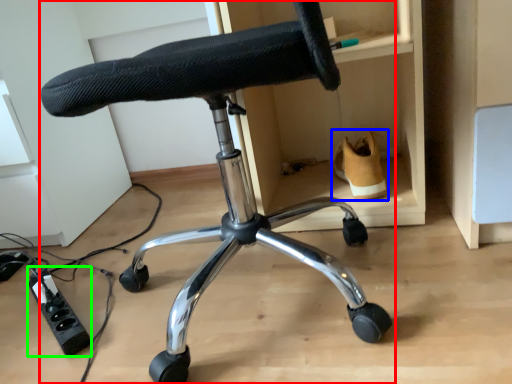
Question: Considering the real-world distances, which object is farthest from chair (highlighted by a red box)? footwear (highlighted by a blue box) or plug (highlighted by a green box)?

Choices:
 (A) footwear
 (B) plug

Answer: (B)